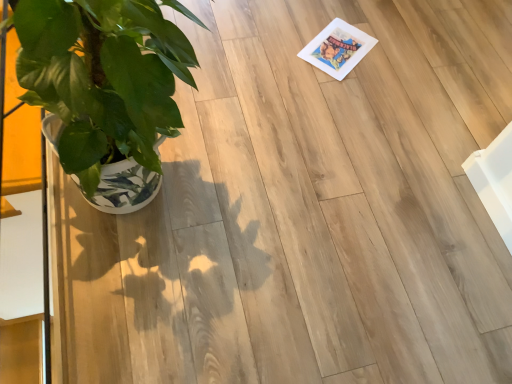
The height and width of the screenshot is (384, 512). Find the location of `vacant location below green glossy plant at left (from a real-world perspective)`. vacant location below green glossy plant at left (from a real-world perspective) is located at coordinates (158, 198).